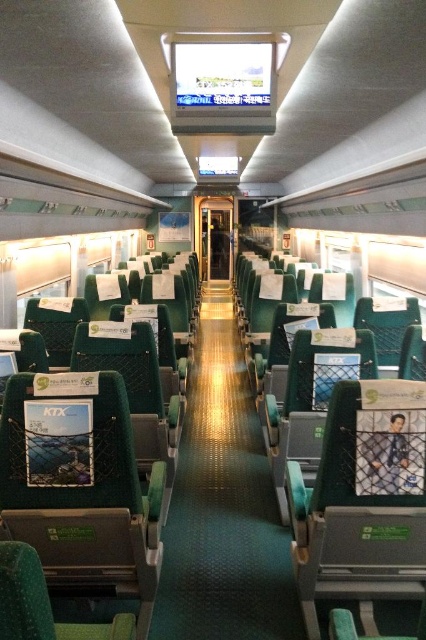
Question: Which point is farther from the camera taking this photo?

Choices:
 (A) (230, 451)
 (B) (394, 412)

Answer: (A)

Question: Which point is closer to the camera?

Choices:
 (A) (290, 624)
 (B) (389, 422)

Answer: (B)

Question: Can you confirm if green fabric aisle at center is thinner than green fabric coach at center?

Choices:
 (A) no
 (B) yes

Answer: (A)

Question: Does green fabric aisle at center appear over green fabric coach at center?

Choices:
 (A) no
 (B) yes

Answer: (A)

Question: Is green fabric aisle at center further to the viewer compared to green fabric coach at center?

Choices:
 (A) yes
 (B) no

Answer: (A)

Question: Which of the following is the farthest from the observer?

Choices:
 (A) (196, 540)
 (B) (400, 470)

Answer: (A)